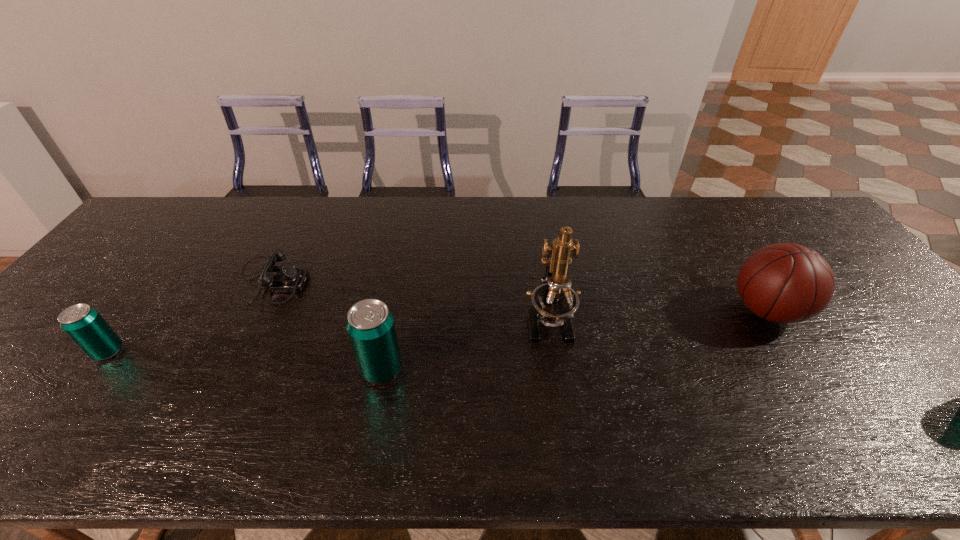
Given the evenly spaced beer cans in the image, where should an extra beer can be added on the right to preserve the spacing? Please point to a vacant space. Please provide its 2D coordinates. Your answer should be formatted as a tuple, i.e. [(x, y)], where the tuple contains the x and y coordinates of a point satisfying the conditions above.

[(675, 387)]